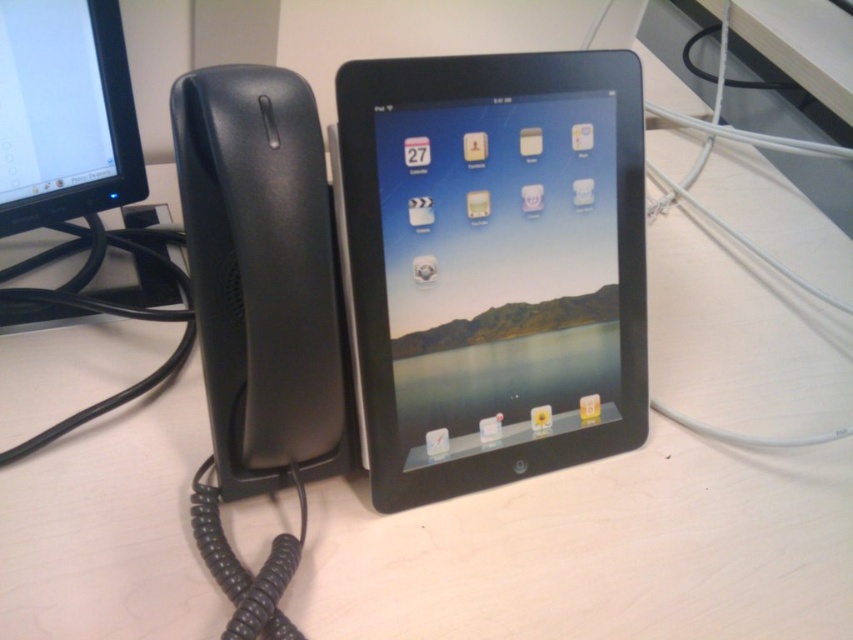
Question: Among these points, which one is nearest to the camera?

Choices:
 (A) (492, 282)
 (B) (57, 132)

Answer: (A)

Question: From the image, what is the correct spatial relationship of black glossy tablet at center in relation to matte black monitor at upper left?

Choices:
 (A) above
 (B) below

Answer: (B)

Question: Can you confirm if black glossy tablet at center is bigger than matte black monitor at upper left?

Choices:
 (A) yes
 (B) no

Answer: (A)

Question: Is black glossy tablet at center further to camera compared to matte black monitor at upper left?

Choices:
 (A) yes
 (B) no

Answer: (B)